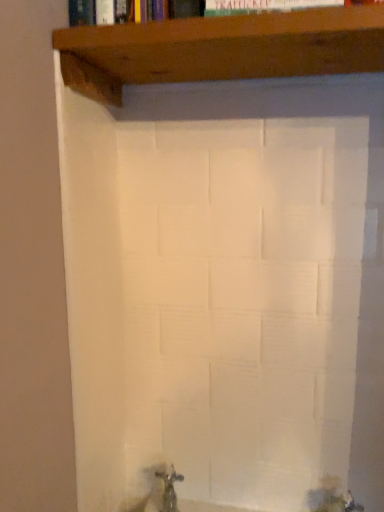
Question: Would you consider metallic silver tap at lower center to be distant from brown wood shelf at upper center?

Choices:
 (A) no
 (B) yes

Answer: (A)

Question: Would you say metallic silver tap at lower center contains brown wood shelf at upper center?

Choices:
 (A) no
 (B) yes

Answer: (A)

Question: Is metallic silver tap at lower center bigger than brown wood shelf at upper center?

Choices:
 (A) no
 (B) yes

Answer: (A)

Question: Is metallic silver tap at lower center not within brown wood shelf at upper center?

Choices:
 (A) yes
 (B) no

Answer: (A)

Question: Does metallic silver tap at lower center come in front of brown wood shelf at upper center?

Choices:
 (A) no
 (B) yes

Answer: (A)

Question: Is metallic silver tap at lower center turned away from brown wood shelf at upper center?

Choices:
 (A) yes
 (B) no

Answer: (B)

Question: Is brown wood shelf at upper center at the left side of metallic silver tap at lower center?

Choices:
 (A) no
 (B) yes

Answer: (A)

Question: Does brown wood shelf at upper center have a greater width compared to metallic silver tap at lower center?

Choices:
 (A) no
 (B) yes

Answer: (B)

Question: Does brown wood shelf at upper center have a lesser width compared to metallic silver tap at lower center?

Choices:
 (A) yes
 (B) no

Answer: (B)

Question: From a real-world perspective, is brown wood shelf at upper center on metallic silver tap at lower center?

Choices:
 (A) no
 (B) yes

Answer: (B)

Question: Does brown wood shelf at upper center appear on the right side of metallic silver tap at lower center?

Choices:
 (A) yes
 (B) no

Answer: (A)

Question: Is brown wood shelf at upper center positioned behind metallic silver tap at lower center?

Choices:
 (A) yes
 (B) no

Answer: (B)

Question: From a real-world perspective, is brown wood shelf at upper center physically located above or below metallic silver tap at lower center?

Choices:
 (A) above
 (B) below

Answer: (A)